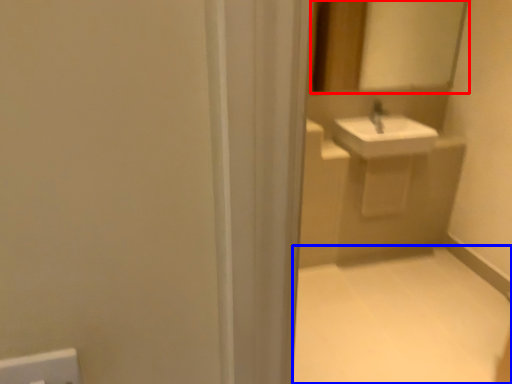
Question: Among these objects, which one is nearest to the camera, mirror (highlighted by a red box) or plain (highlighted by a blue box)?

Choices:
 (A) mirror
 (B) plain

Answer: (B)